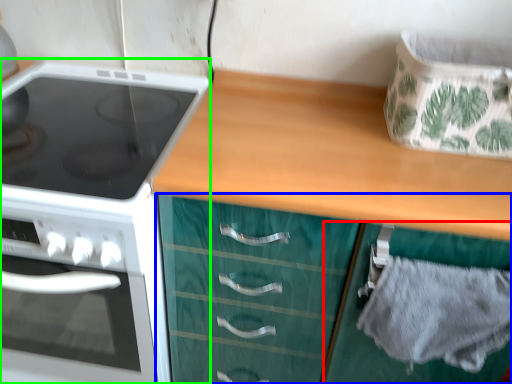
Question: Estimate the real-world distances between objects in this image. Which object is farther from cabinetry (highlighted by a red box), cabinetry (highlighted by a blue box) or kitchen appliance (highlighted by a green box)?

Choices:
 (A) cabinetry
 (B) kitchen appliance

Answer: (B)